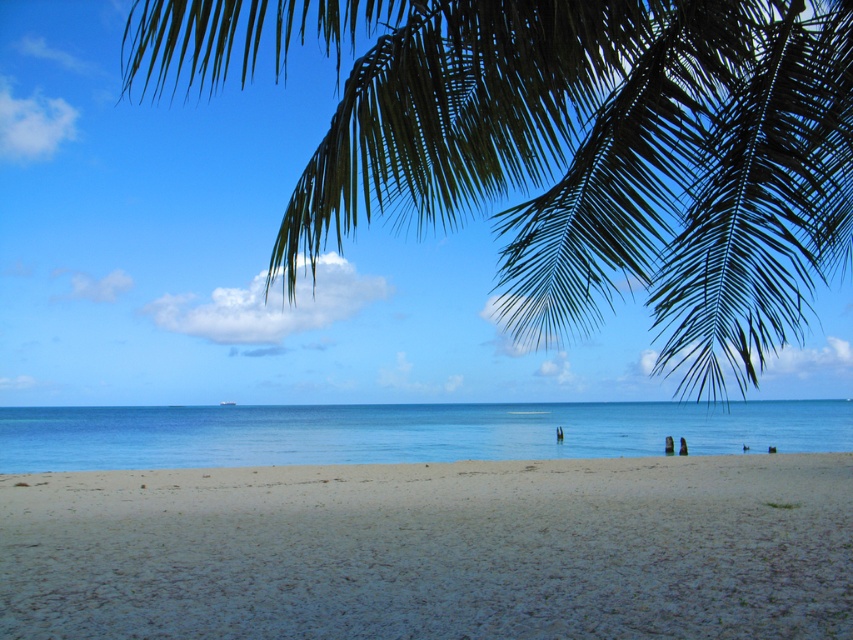
You are standing on the sandy beach in the foreground and want to take a photo of the green leafy palm at upper center. Based on its position, where should you aim your camera to capture it in the frame?

You should aim your camera towards the upper center of the frame, specifically at the coordinates point (572, 148), to capture the green leafy palm at upper center in the photo.

Based on the photo, you are planning to build a sandcastle on the light brown sandy beach at lower center and a small boat on the blue water at center. Which area do you think will provide more space for your creation?

The light brown sandy beach at lower center is larger in size than the blue water at center, so it will provide more space for building the sandcastle.

You are standing on the beach and see two points marked in the scene. The first point is at coordinates point (x=619, y=44) and the second is at point (x=550, y=556). Which point is closer to you?

Point (x=619, y=44) is in front of point (x=550, y=556), so the first point is closer to you.